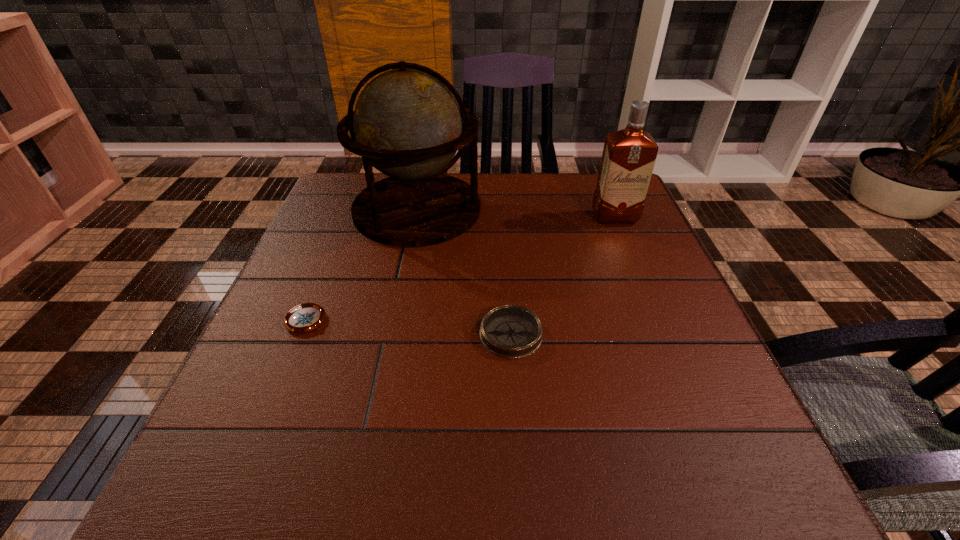
Locate an element on the screen. Image resolution: width=960 pixels, height=540 pixels. free space located 0.090m on the front of the shorter compass is located at coordinates (285, 375).

The width and height of the screenshot is (960, 540). In order to click on globe at the far edge in this screenshot , I will do (x=407, y=124).

Image resolution: width=960 pixels, height=540 pixels. In order to click on liquor at the far edge in this screenshot , I will do `click(629, 155)`.

Locate an element on the screen. The image size is (960, 540). globe located at the left edge is located at coordinates (407, 124).

I want to click on compass positioned at the left edge, so click(x=306, y=317).

You are a GUI agent. You are given a task and a screenshot of the screen. Output one action in this format:
    pyautogui.click(x=<x>, y=<y>)
    Task: Click on the object located at the right edge
    The height and width of the screenshot is (540, 960).
    Given the screenshot: What is the action you would take?
    (629, 155)

Locate an element on the screen. The width and height of the screenshot is (960, 540). object that is positioned at the far left corner is located at coordinates (407, 124).

Where is `object located in the far right corner section of the desktop`? object located in the far right corner section of the desktop is located at coordinates click(629, 155).

Where is `vacant area at the far edge`? vacant area at the far edge is located at coordinates (495, 183).

In the image, there is a desktop. Where is `vacant space at the left edge`? This screenshot has height=540, width=960. vacant space at the left edge is located at coordinates (341, 261).